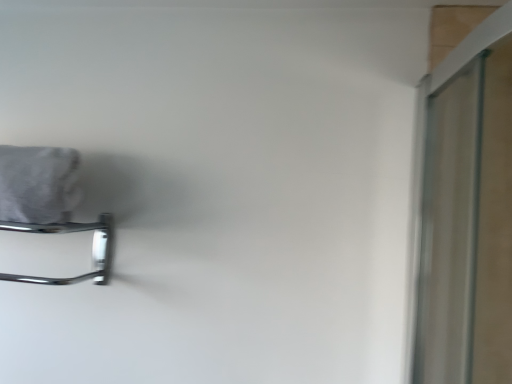
Question: Is gray fabric bath towel at upper left in front of or behind chrome metallic towel rack at left in the image?

Choices:
 (A) front
 (B) behind

Answer: (A)

Question: Is point (25, 153) closer or farther from the camera than point (87, 276)?

Choices:
 (A) farther
 (B) closer

Answer: (B)

Question: Is gray fabric bath towel at upper left wider or thinner than chrome metallic towel rack at left?

Choices:
 (A) thin
 (B) wide

Answer: (B)

Question: Considering the positions of point (99, 258) and point (20, 160), is point (99, 258) closer or farther from the camera than point (20, 160)?

Choices:
 (A) closer
 (B) farther

Answer: (B)

Question: From their relative heights in the image, would you say chrome metallic towel rack at left is taller or shorter than gray fabric bath towel at upper left?

Choices:
 (A) short
 (B) tall

Answer: (A)

Question: From the image's perspective, is chrome metallic towel rack at left located above or below gray fabric bath towel at upper left?

Choices:
 (A) above
 (B) below

Answer: (B)

Question: Considering the relative positions of chrome metallic towel rack at left and gray fabric bath towel at upper left in the image provided, is chrome metallic towel rack at left to the left or to the right of gray fabric bath towel at upper left?

Choices:
 (A) left
 (B) right

Answer: (B)